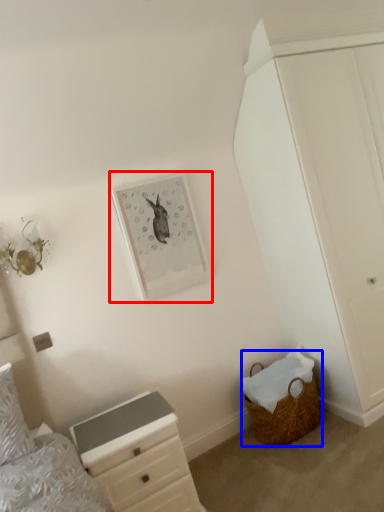
Question: Among these objects, which one is nearest to the camera, picture frame (highlighted by a red box) or basket (highlighted by a blue box)?

Choices:
 (A) picture frame
 (B) basket

Answer: (B)